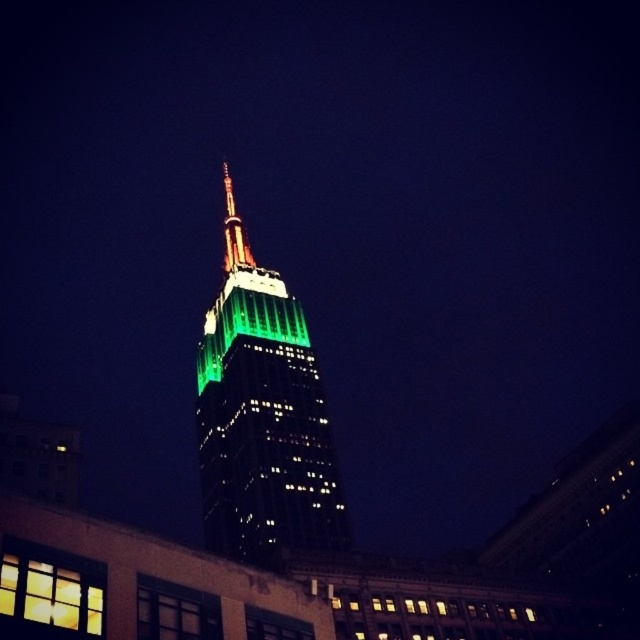
Measure the distance from green glass tower at center to shiny metallic spire at center.

69.94 feet

Between point (340, 529) and point (230, 196), which one is positioned in front?

Point (340, 529)

Does point (218, 433) come closer to viewer compared to point (225, 189)?

Yes, it is.

You are a GUI agent. You are given a task and a screenshot of the screen. Output one action in this format:
    pyautogui.click(x=<x>, y=<y>)
    Task: Click on the green glass tower at center
    
    Given the screenshot: What is the action you would take?
    pyautogui.click(x=262, y=417)